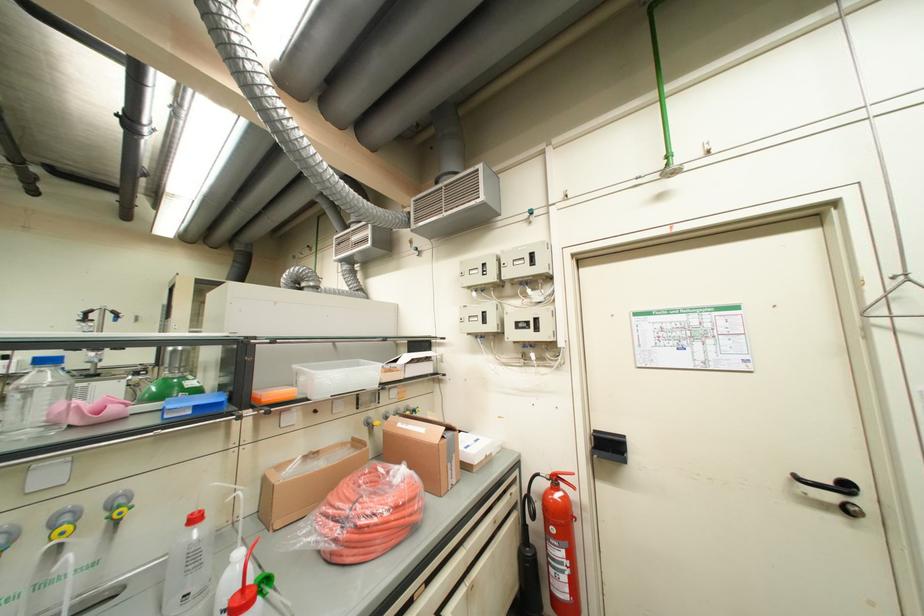
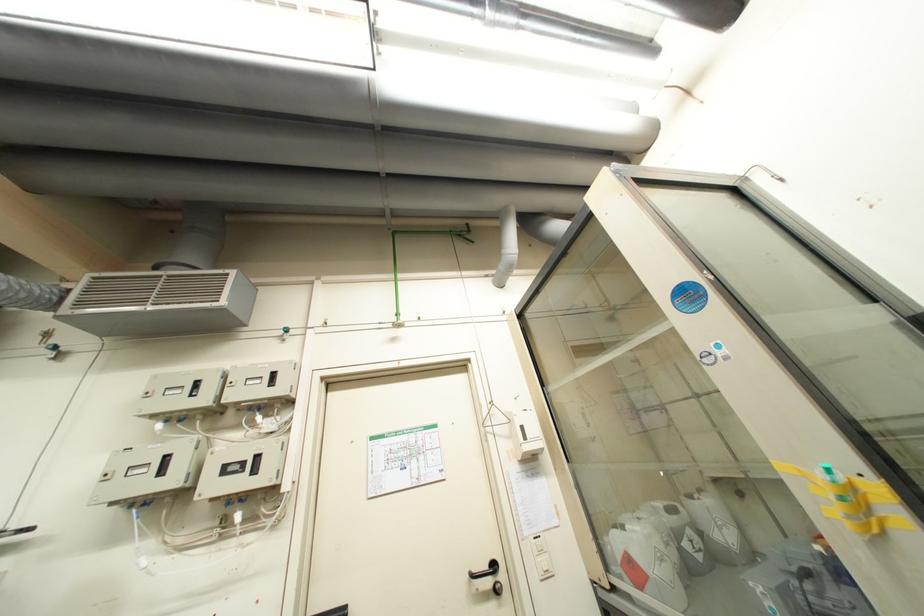
First-person continuous shooting, in which direction is the camera rotating?

The camera's rotation is toward right-up.